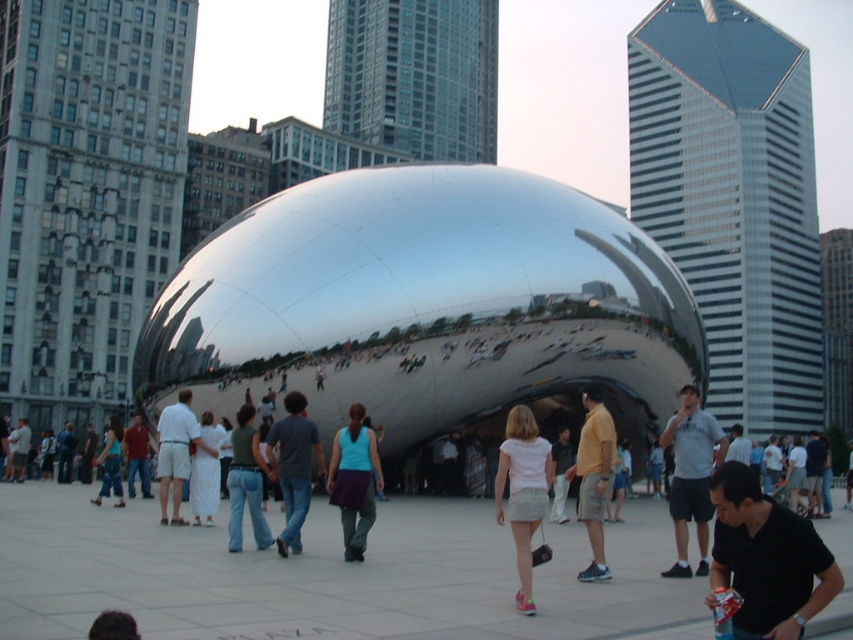
Between yellow matte shirt at center and white cotton shirt at center, which one appears on the left side from the viewer's perspective?

white cotton shirt at center

What do you see at coordinates (595, 477) in the screenshot? This screenshot has height=640, width=853. I see `yellow matte shirt at center` at bounding box center [595, 477].

Is point (602, 444) positioned before point (198, 433)?

Yes, point (602, 444) is closer to viewer.

Find the location of a particular element. The image size is (853, 640). yellow matte shirt at center is located at coordinates (x=595, y=477).

Is point (743, 524) more distant than point (241, 483)?

That is False.

Is point (762, 598) positioned in front of point (236, 508)?

Yes, it is in front of point (236, 508).

Who is more distant from viewer, (712, 557) or (234, 538)?

The point (234, 538) is behind.

Identify the location of black matte shirt at lower right. The width and height of the screenshot is (853, 640). (766, 557).

Is white matte shorts at center bigger than white cotton shirt at center?

Indeed, white matte shorts at center has a larger size compared to white cotton shirt at center.

Can you confirm if white matte shorts at center is wider than white cotton shirt at center?

Yes.

Which is in front, point (525, 570) or point (161, 513)?

Point (525, 570) is more forward.

Image resolution: width=853 pixels, height=640 pixels. Find the location of `white matte shorts at center`. white matte shorts at center is located at coordinates (521, 492).